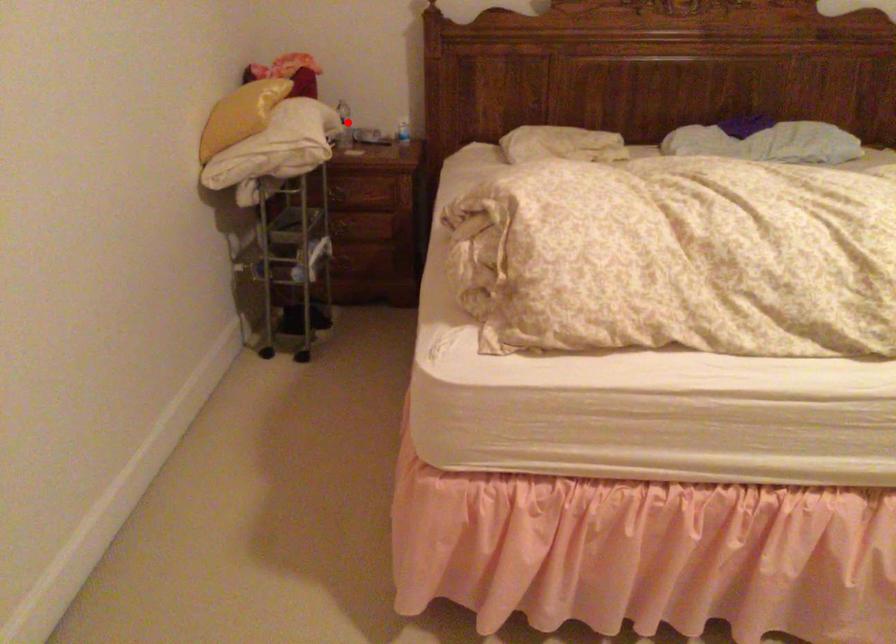
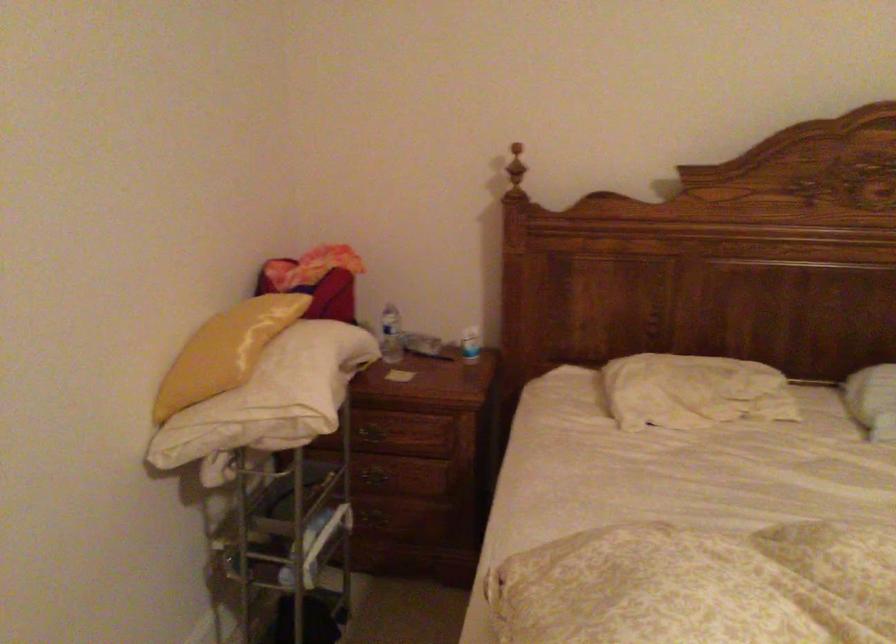
In the second image, find the point that corresponds to the highlighted location in the first image.

(391, 335)